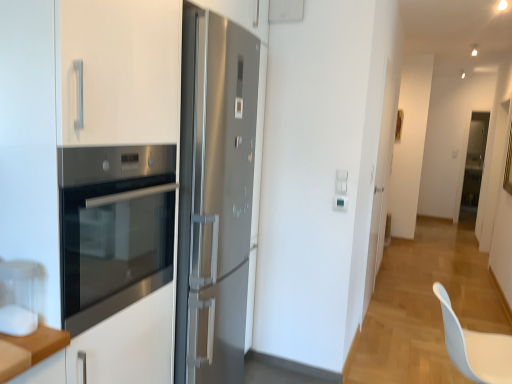
Question: Is white plastic swivel chair at lower right to the left of white matte cabinet at left from the viewer's perspective?

Choices:
 (A) no
 (B) yes

Answer: (A)

Question: Is white plastic swivel chair at lower right next to white matte cabinet at left and touching it?

Choices:
 (A) no
 (B) yes

Answer: (A)

Question: Is white plastic swivel chair at lower right bigger than white matte cabinet at left?

Choices:
 (A) no
 (B) yes

Answer: (A)

Question: From a real-world perspective, is white plastic swivel chair at lower right physically below white matte cabinet at left?

Choices:
 (A) yes
 (B) no

Answer: (A)

Question: Is white plastic swivel chair at lower right in front of white matte cabinet at left?

Choices:
 (A) no
 (B) yes

Answer: (A)

Question: Is white matte cabinet at left wider or thinner than white plastic swivel chair at lower right?

Choices:
 (A) wide
 (B) thin

Answer: (A)

Question: Relative to white plastic swivel chair at lower right, is white matte cabinet at left in front or behind?

Choices:
 (A) behind
 (B) front

Answer: (B)

Question: Considering the positions of point (31, 56) and point (443, 294), is point (31, 56) closer or farther from the camera than point (443, 294)?

Choices:
 (A) farther
 (B) closer

Answer: (B)

Question: Considering the positions of white matte cabinet at left and white plastic swivel chair at lower right in the image, is white matte cabinet at left bigger or smaller than white plastic swivel chair at lower right?

Choices:
 (A) big
 (B) small

Answer: (A)

Question: From a real-world perspective, is stainless steel oven at left physically located above or below white plastic swivel chair at lower right?

Choices:
 (A) below
 (B) above

Answer: (B)

Question: Would you say stainless steel oven at left is to the left or to the right of white plastic swivel chair at lower right in the picture?

Choices:
 (A) left
 (B) right

Answer: (A)

Question: Is stainless steel oven at left wider or thinner than white plastic swivel chair at lower right?

Choices:
 (A) thin
 (B) wide

Answer: (B)

Question: Is stainless steel oven at left inside or outside of white plastic swivel chair at lower right?

Choices:
 (A) inside
 (B) outside

Answer: (B)

Question: Relative to transparent glass door at center, is stainless steel oven at left in front or behind?

Choices:
 (A) front
 (B) behind

Answer: (A)

Question: Is point (64, 218) closer or farther from the camera than point (466, 205)?

Choices:
 (A) farther
 (B) closer

Answer: (B)